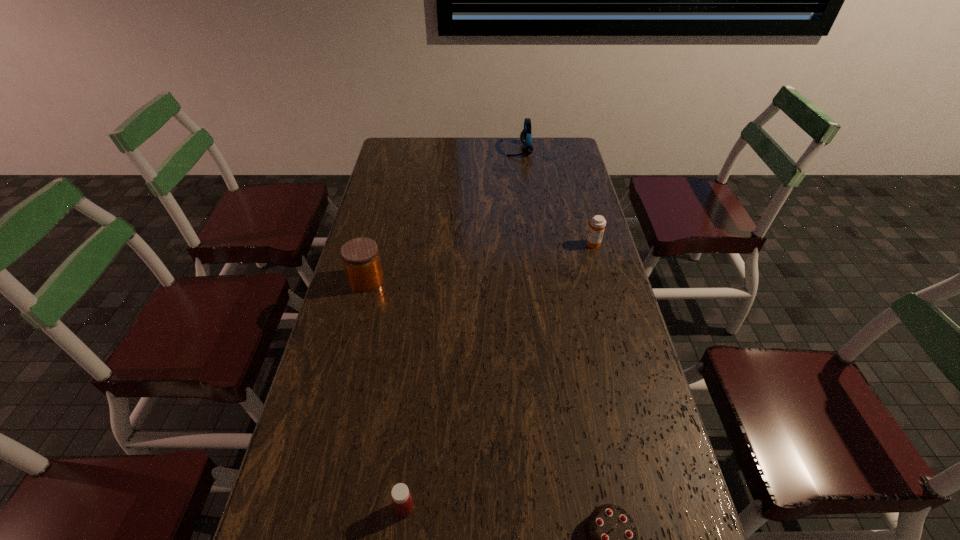
Where is `headset`? Image resolution: width=960 pixels, height=540 pixels. headset is located at coordinates (525, 136).

Find the location of a particular element. This screenshot has height=540, width=960. jar is located at coordinates (360, 256).

In order to click on the leftmost object in this screenshot , I will do `click(360, 256)`.

Locate an element on the screen. The width and height of the screenshot is (960, 540). the third shortest object is located at coordinates (597, 224).

The image size is (960, 540). What are the coordinates of `the taller medicine` in the screenshot? It's located at (597, 224).

Where is `the second object from left to right`? This screenshot has width=960, height=540. the second object from left to right is located at coordinates (402, 500).

Find the location of a particular element. This screenshot has height=540, width=960. the shorter medicine is located at coordinates (402, 500).

Where is `vacant space located with the microphone attached to the side of the headset`? This screenshot has height=540, width=960. vacant space located with the microphone attached to the side of the headset is located at coordinates (473, 150).

You are a GUI agent. You are given a task and a screenshot of the screen. Output one action in this format:
    pyautogui.click(x=<x>, y=<y>)
    Task: Click on the vacant area situated with the microphone attached to the side of the headset
    The image size is (960, 540).
    Given the screenshot: What is the action you would take?
    pyautogui.click(x=432, y=150)

The height and width of the screenshot is (540, 960). Find the location of `vacant point located with the microphone attached to the side of the headset`. vacant point located with the microphone attached to the side of the headset is located at coordinates (465, 150).